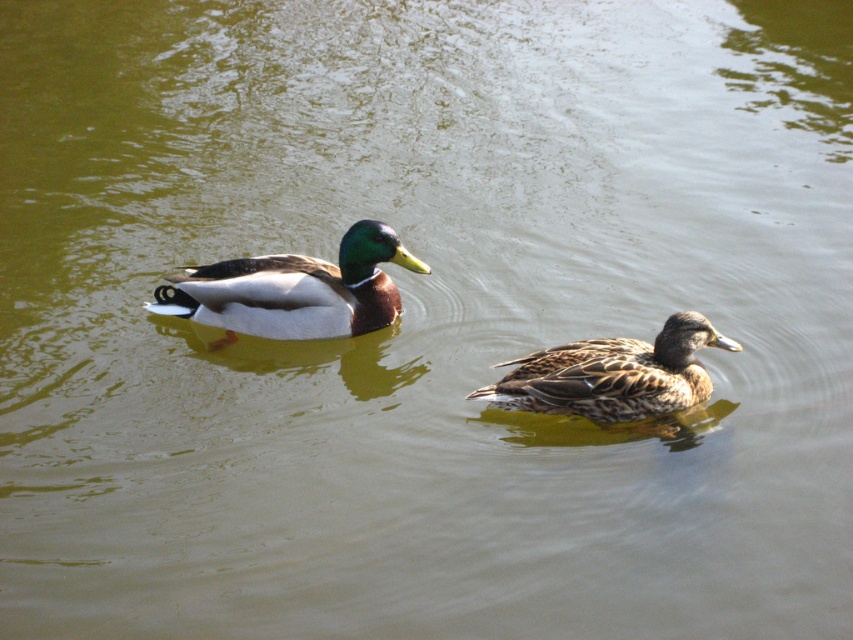
Looking at this image, you are a photographer trying to capture both the shiny brown duck at center and the brown speckled feathers at center in a single frame. Given their widths, which duck should you focus on to ensure both fit in the shot?

The shiny brown duck at center is wider than the brown speckled feathers at center, so focusing on the shiny brown duck at center will ensure both fit in the shot as it occupies more space.